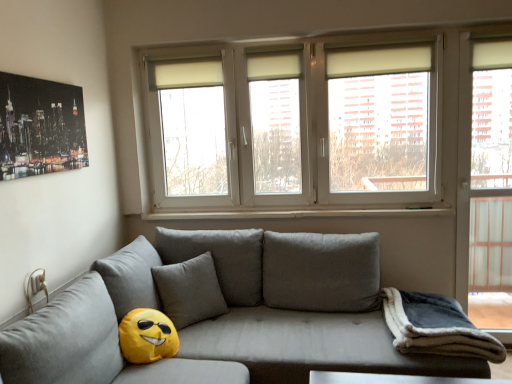
Question: Relative to white plastic window sill at center, is transparent glass door at right in front or behind?

Choices:
 (A) front
 (B) behind

Answer: (A)

Question: Is transparent glass door at right inside or outside of white plastic window sill at center?

Choices:
 (A) inside
 (B) outside

Answer: (B)

Question: Estimate the real-world distances between objects in this image. Which object is farther from the white plastic window at upper center?

Choices:
 (A) beige fabric curtain at upper center, which appears as the first curtain when viewed from the right
 (B) shiny metallic poster at upper left
 (C) yellow fabric emoji at lower left
 (D) white matte curtain at upper center, marked as the second curtain in a front-to-back arrangement
 (E) dark gray fleece blanket at lower right

Answer: (B)

Question: Based on their relative distances, which object is farther from the matte gray couch at center?

Choices:
 (A) transparent glass door at right
 (B) white matte curtain at upper center, acting as the 1th curtain starting from the back
 (C) dark gray fleece blanket at lower right
 (D) beige fabric curtain at upper center, arranged as the 2th curtain when viewed from the back
 (E) white plastic window at upper center

Answer: (D)